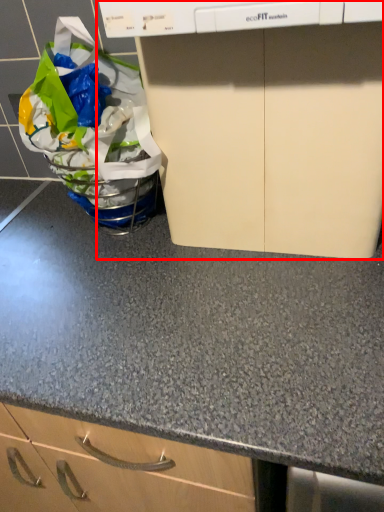
Question: From the image's perspective, considering the relative positions of home appliance (annotated by the red box) and grocery bag in the image provided, where is home appliance (annotated by the red box) located with respect to the staircase?

Choices:
 (A) above
 (B) below

Answer: (B)